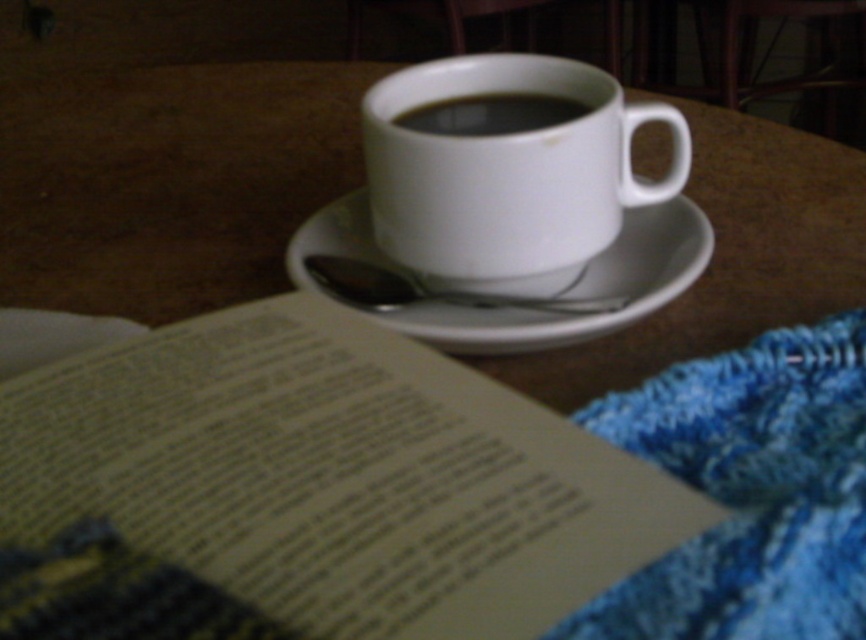
Between point (645, 236) and point (518, 97), which one is positioned in front?

Point (518, 97) is more forward.

This screenshot has height=640, width=866. What do you see at coordinates (521, 289) in the screenshot?
I see `white ceramic saucer at center` at bounding box center [521, 289].

Locate an element on the screen. white ceramic saucer at center is located at coordinates [521, 289].

Which is in front, point (341, 515) or point (423, 124)?

Positioned in front is point (341, 515).

Between paper book at center and black matte cup at center, which one has more height?

With more height is paper book at center.

At what (x,y) coordinates should I click in order to perform the action: click on paper book at center. Please return your answer as a coordinate pair (x, y). This screenshot has height=640, width=866. Looking at the image, I should click on (307, 490).

Can you confirm if paper book at center is positioned below white ceramic mug at upper center?

Yes.

Between point (347, 429) and point (417, 193), which one is positioned in front?

Point (347, 429) is more forward.

Locate an element on the screen. The height and width of the screenshot is (640, 866). paper book at center is located at coordinates (307, 490).